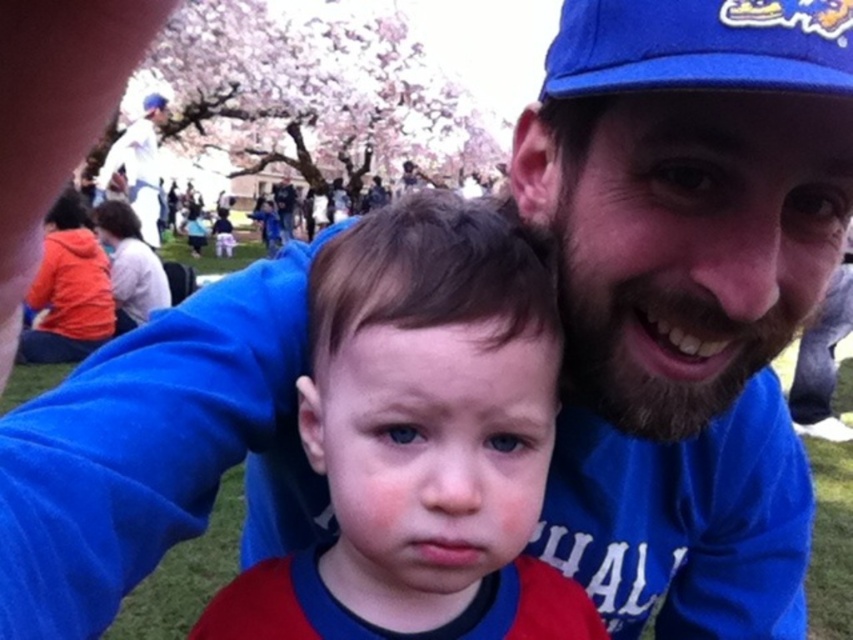
Which is in front, point (500, 264) or point (817, 88)?

Positioned in front is point (817, 88).

Is smooth red shirt at center behind blue fabric baseball cap at upper right?

Yes, smooth red shirt at center is behind blue fabric baseball cap at upper right.

The height and width of the screenshot is (640, 853). Find the location of `smooth red shirt at center`. smooth red shirt at center is located at coordinates (422, 440).